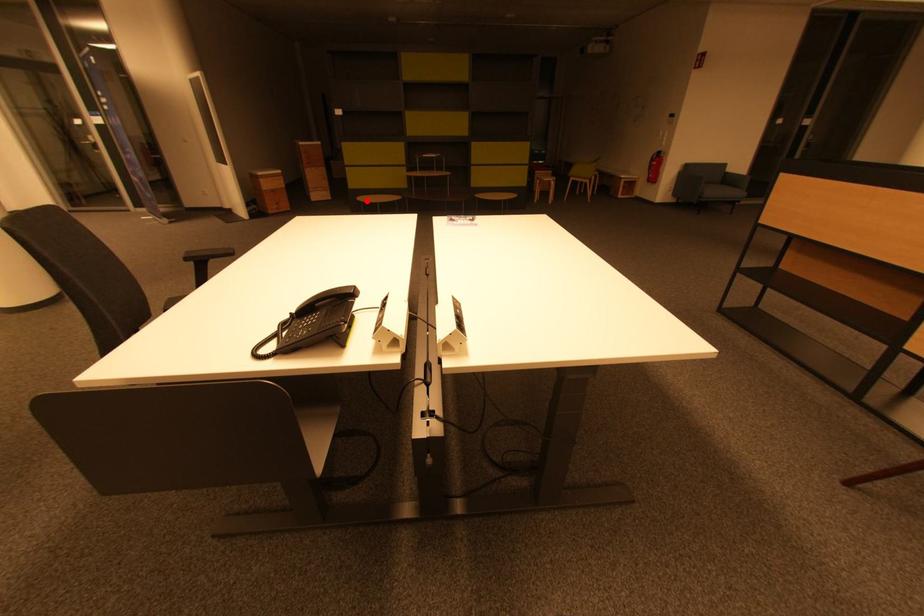
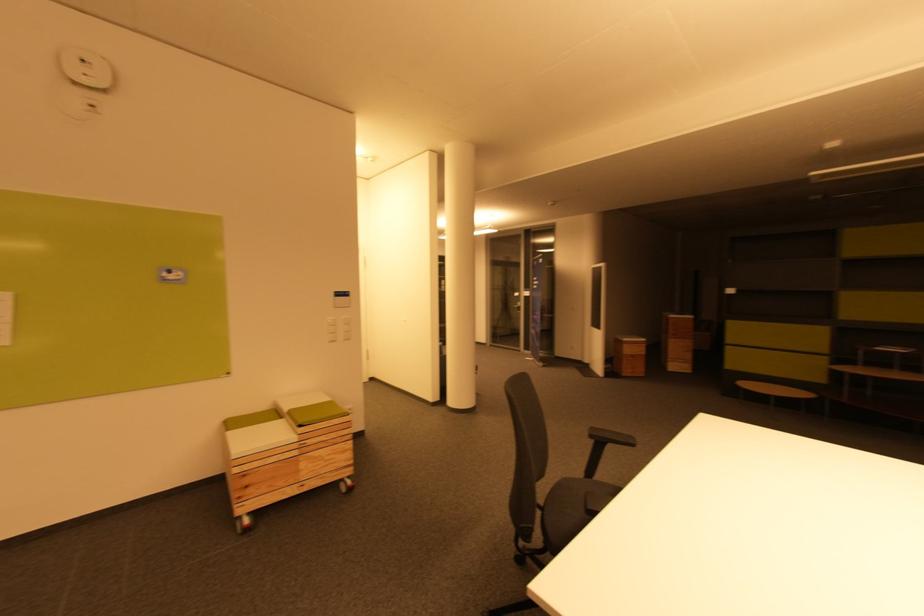
Locate, in the second image, the point that corresponds to the highlighted location in the first image.

(748, 387)